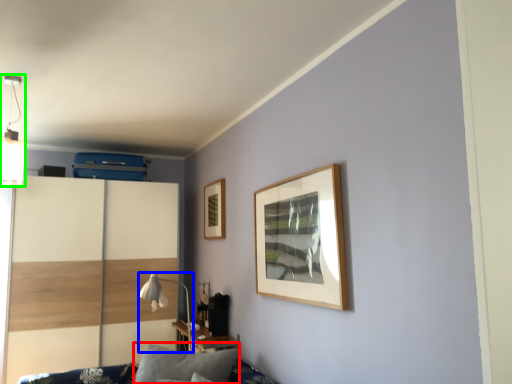
Question: Which object is the farthest from pillow (highlighted by a red box)? Choose among these: table lamp (highlighted by a blue box) or light fixture (highlighted by a green box).

Choices:
 (A) table lamp
 (B) light fixture

Answer: (B)